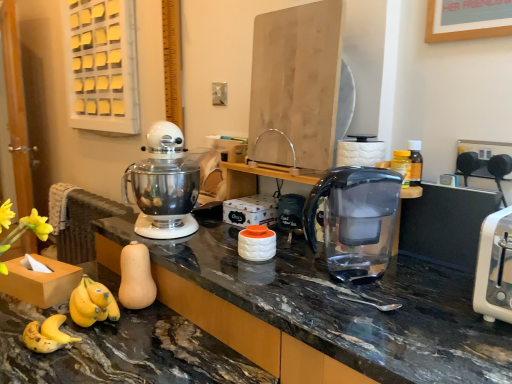
Locate an element on the screen. vacant space to the left of transparent plastic water filter pitcher at center is located at coordinates (287, 283).